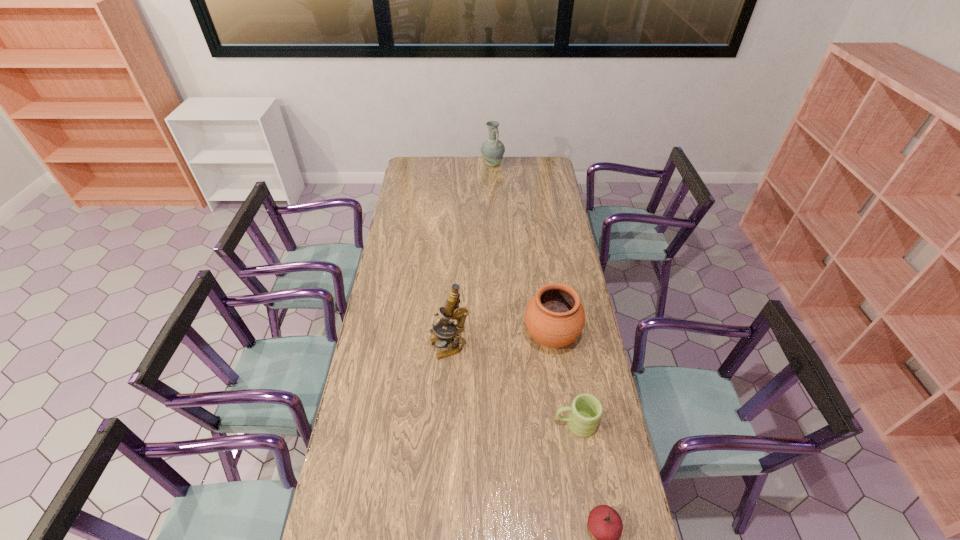
Identify the location of vacant space in between the leftmost object and the pottery. (500, 342).

Find the location of a particular element. This screenshot has width=960, height=540. empty space that is in between the leftmost object and the second shortest object is located at coordinates (513, 386).

Locate which object is the closest to the tomato. Please provide its 2D coordinates. Your answer should be formatted as a tuple, i.e. [(x, y)], where the tuple contains the x and y coordinates of a point satisfying the conditions above.

[(586, 410)]

The width and height of the screenshot is (960, 540). Find the location of `the closest object relative to the pottery`. the closest object relative to the pottery is located at coordinates (586, 410).

This screenshot has height=540, width=960. I want to click on vacant space that satisfies the following two spatial constraints: 1. on the back side of the pottery; 2. on the left side of the microscope, so click(x=450, y=337).